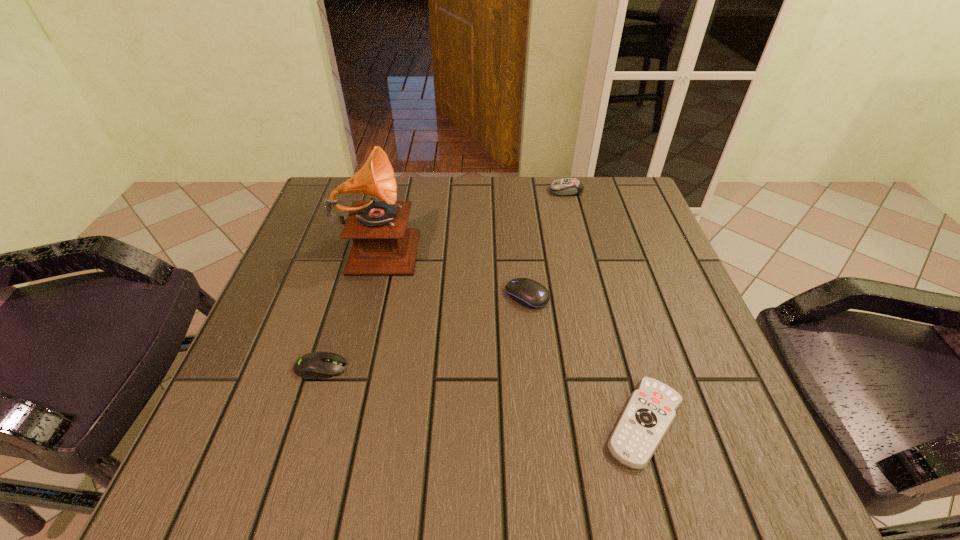
You are a GUI agent. You are given a task and a screenshot of the screen. Output one action in this format:
    pyautogui.click(x=<x>, y=<y>)
    Task: Click on the free space that satisfies the following two spatial constraints: 1. on the wheel side of the shortest computer mouse; 2. on the left side of the remote control
    The width and height of the screenshot is (960, 540).
    Given the screenshot: What is the action you would take?
    pyautogui.click(x=304, y=423)

Locate an element on the screen. The width and height of the screenshot is (960, 540). vacant area that satisfies the following two spatial constraints: 1. on the back side of the second computer mouse from left to right; 2. on the horn of the phonograph record is located at coordinates (521, 245).

What are the coordinates of `vacant region that satisfies the following two spatial constraints: 1. on the wheel side of the leftmost computer mouse; 2. on the right side of the shortest object` in the screenshot? It's located at (304, 423).

Locate an element on the screen. The height and width of the screenshot is (540, 960). vacant point that satisfies the following two spatial constraints: 1. on the wheel side of the nearest computer mouse; 2. on the left side of the remote control is located at coordinates (304, 423).

Where is `free space that satisfies the following two spatial constraints: 1. on the wheel side of the rightmost computer mouse; 2. on the right side of the remote control`? The height and width of the screenshot is (540, 960). free space that satisfies the following two spatial constraints: 1. on the wheel side of the rightmost computer mouse; 2. on the right side of the remote control is located at coordinates (625, 423).